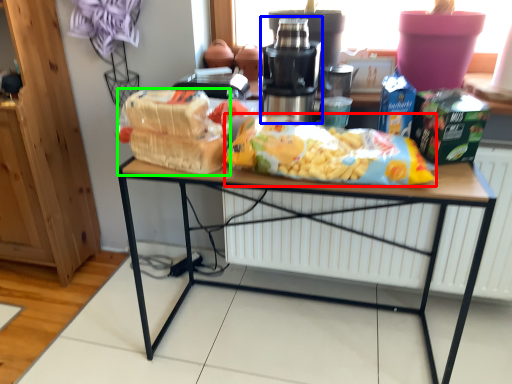
Question: Which is farther away from cereal (highlighted by a red box)? tableware (highlighted by a blue box) or snack (highlighted by a green box)?

Choices:
 (A) tableware
 (B) snack

Answer: (B)